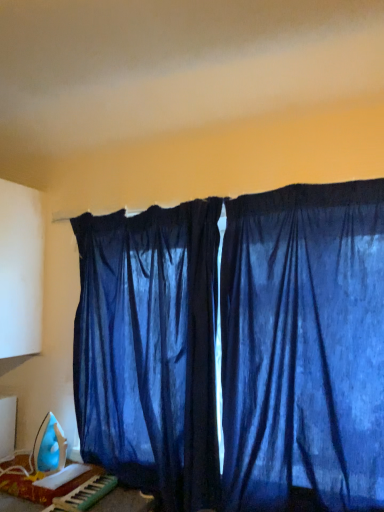
Question: Is blue sheer curtains at center, which is the 1th curtain in right-to-left order, a part of blue plastic iron at lower left?

Choices:
 (A) no
 (B) yes

Answer: (A)

Question: Is the position of blue plastic iron at lower left more distant than that of blue sheer curtains at center, which is the 1th curtain in right-to-left order?

Choices:
 (A) yes
 (B) no

Answer: (A)

Question: Are blue plastic iron at lower left and blue sheer curtains at center, which is the 1th curtain in right-to-left order, located far from each other?

Choices:
 (A) no
 (B) yes

Answer: (A)

Question: Is blue plastic iron at lower left outside of blue sheer curtains at center, which is the 1th curtain in right-to-left order?

Choices:
 (A) yes
 (B) no

Answer: (A)

Question: Considering the relative sizes of blue plastic iron at lower left and blue sheer curtains at center, which is the 1th curtain in right-to-left order, in the image provided, is blue plastic iron at lower left bigger than blue sheer curtains at center, which is the 1th curtain in right-to-left order,?

Choices:
 (A) yes
 (B) no

Answer: (B)

Question: Considering the relative positions of blue plastic iron at lower left and blue sheer curtains at center, the second curtain viewed from the left, in the image provided, is blue plastic iron at lower left in front of blue sheer curtains at center, the second curtain viewed from the left,?

Choices:
 (A) yes
 (B) no

Answer: (B)

Question: Is plastic green and white musical keyboard at lower left located within satin blue curtain at center, the second curtain when ordered from right to left?

Choices:
 (A) no
 (B) yes

Answer: (A)

Question: Is satin blue curtain at center, the second curtain when ordered from right to left, wider than plastic green and white musical keyboard at lower left?

Choices:
 (A) yes
 (B) no

Answer: (B)

Question: Does satin blue curtain at center, which is counted as the 1th curtain, starting from the left, have a larger size compared to plastic green and white musical keyboard at lower left?

Choices:
 (A) yes
 (B) no

Answer: (A)

Question: Is satin blue curtain at center, the second curtain when ordered from right to left, located outside plastic green and white musical keyboard at lower left?

Choices:
 (A) no
 (B) yes

Answer: (B)

Question: Is satin blue curtain at center, the second curtain when ordered from right to left, looking in the opposite direction of plastic green and white musical keyboard at lower left?

Choices:
 (A) no
 (B) yes

Answer: (B)

Question: Is satin blue curtain at center, which is counted as the 1th curtain, starting from the left, closer to the viewer compared to plastic green and white musical keyboard at lower left?

Choices:
 (A) no
 (B) yes

Answer: (A)

Question: Can you confirm if blue sheer curtains at center, the second curtain viewed from the left, is thinner than satin blue curtain at center, the second curtain when ordered from right to left?

Choices:
 (A) yes
 (B) no

Answer: (A)